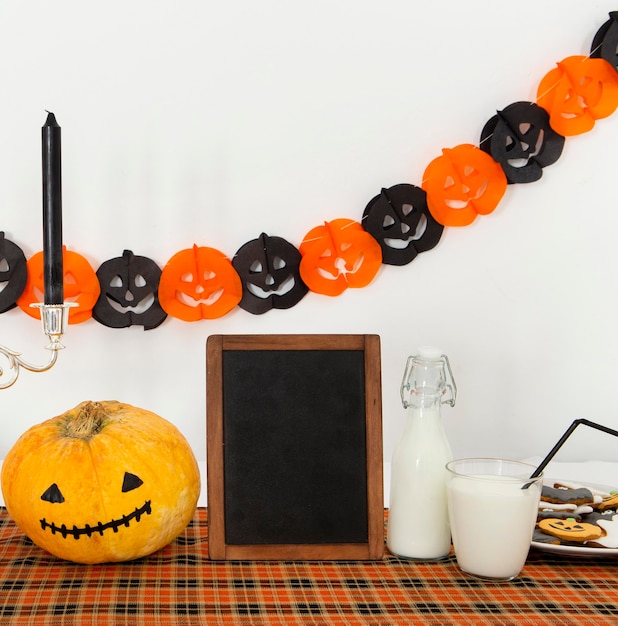
Find the location of `checkered tablecloth`. checkered tablecloth is located at coordinates (381, 596).